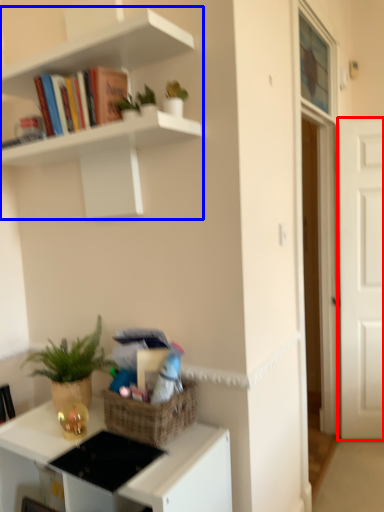
Question: Which object is closer to the camera taking this photo, door (highlighted by a red box) or shelf (highlighted by a blue box)?

Choices:
 (A) door
 (B) shelf

Answer: (B)